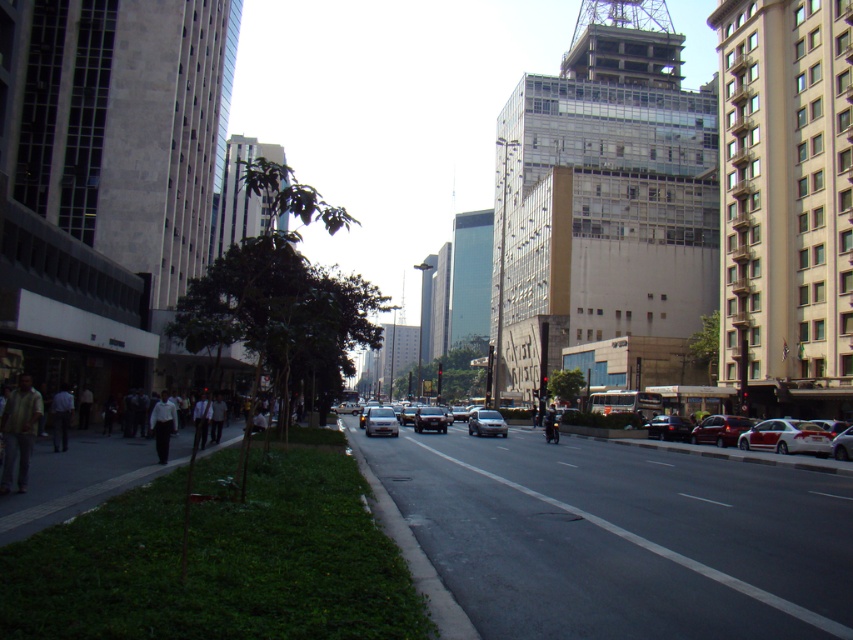
Question: Which point is closer to the camera?

Choices:
 (A) (64, 390)
 (B) (213, 408)
 (C) (486, 429)
 (D) (67, 477)

Answer: (D)

Question: Does shiny red sedan at right have a larger size compared to silver metallic car at center?

Choices:
 (A) no
 (B) yes

Answer: (A)

Question: Which point is closer to the camera?

Choices:
 (A) (199, 401)
 (B) (682, 432)

Answer: (A)

Question: Does white glossy sedan at right appear on the right side of dark blue jeans at center?

Choices:
 (A) yes
 (B) no

Answer: (A)

Question: Based on their relative distances, which object is nearer to the black asphalt road at center?

Choices:
 (A) silver metallic car at center
 (B) shiny red sedan at right

Answer: (B)

Question: Is light gray shirt at left positioned behind silver metallic car at center?

Choices:
 (A) no
 (B) yes

Answer: (A)